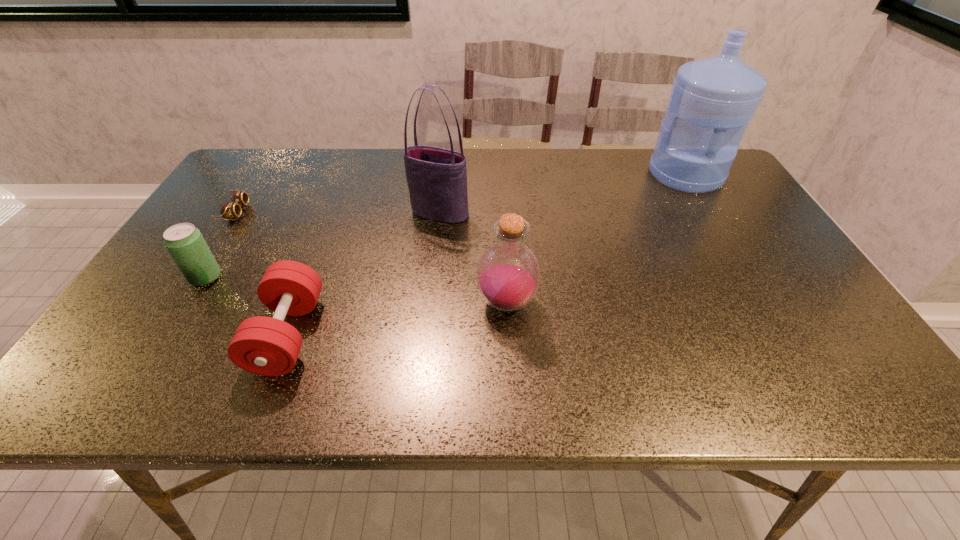
Identify the location of vacant space that satisfies the following two spatial constraints: 1. on the back side of the soda; 2. through the lenses of the goggles. Image resolution: width=960 pixels, height=540 pixels. (247, 212).

Identify the location of vacant area in the image that satisfies the following two spatial constraints: 1. through the lenses of the goggles; 2. on the back side of the second object from right to left. The image size is (960, 540). pyautogui.click(x=177, y=303).

Where is `vacant space that satisfies the following two spatial constraints: 1. through the lenses of the goggles; 2. on the left side of the fifth shortest object`? Image resolution: width=960 pixels, height=540 pixels. vacant space that satisfies the following two spatial constraints: 1. through the lenses of the goggles; 2. on the left side of the fifth shortest object is located at coordinates (235, 213).

Identify the location of vacant position in the image that satisfies the following two spatial constraints: 1. on the side of the rightmost object with the handle; 2. through the lenses of the shortest object. (708, 212).